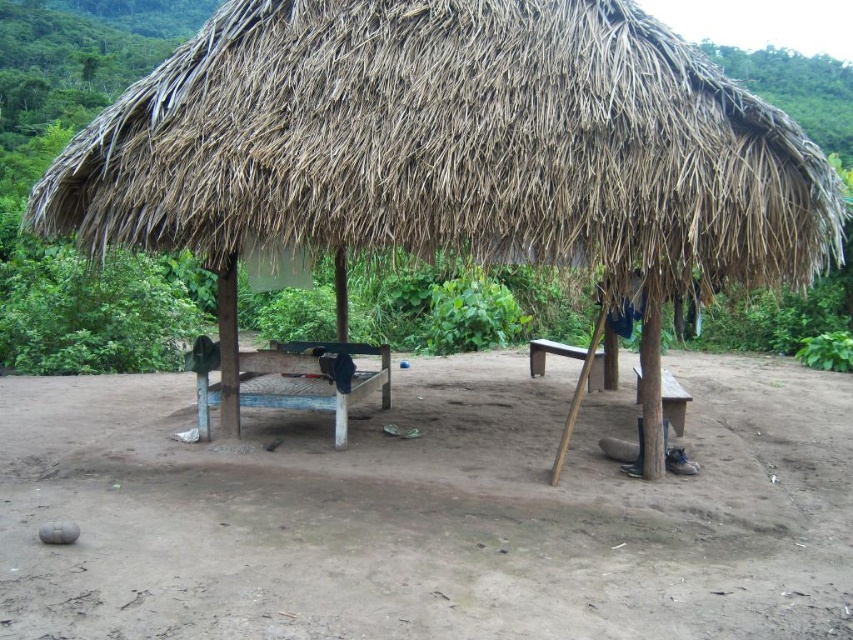
Is brown dirt field at center in front of dry straw roof at upper center?

Yes, it is in front of dry straw roof at upper center.

The height and width of the screenshot is (640, 853). What do you see at coordinates (428, 512) in the screenshot? I see `brown dirt field at center` at bounding box center [428, 512].

The image size is (853, 640). In order to click on brown dirt field at center in this screenshot , I will do `click(428, 512)`.

Image resolution: width=853 pixels, height=640 pixels. In order to click on brown dirt field at center in this screenshot , I will do coord(428,512).

Who is taller, dry straw roof at upper center or wooden picnic table at center?

dry straw roof at upper center

Between point (456, 68) and point (218, 348), which one is positioned in front?

Point (456, 68)

Who is more forward, (730,243) or (386,355)?

Point (730,243) is in front.

Identify the location of dry straw roof at upper center. (450, 141).

Where is `brown dirt field at center`? This screenshot has height=640, width=853. brown dirt field at center is located at coordinates (428, 512).

Can you confirm if brown dirt field at center is positioned to the right of wooden picnic table at center?

Yes, brown dirt field at center is to the right of wooden picnic table at center.

Identify the location of brown dirt field at center. Image resolution: width=853 pixels, height=640 pixels. (428, 512).

Identify the location of brown dirt field at center. (428, 512).